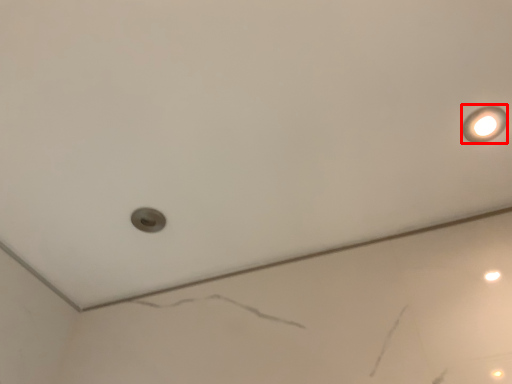
Question: From the image's perspective, what is the correct spatial positioning of light fixture (annotated by the red box) in reference to hole?

Choices:
 (A) above
 (B) below

Answer: (A)